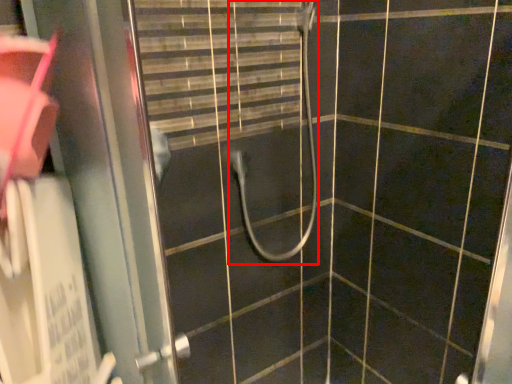
Question: Observing the image, what is the correct spatial positioning of shower (annotated by the red box) in reference to screen door?

Choices:
 (A) left
 (B) right

Answer: (B)